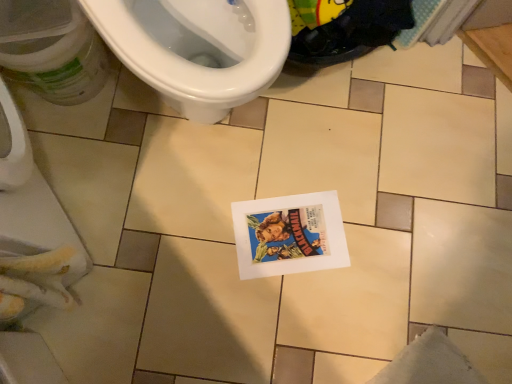
Where is `vacant space situated above white paper comic book at center (from a real-world perspective)`? vacant space situated above white paper comic book at center (from a real-world perspective) is located at coordinates (295, 235).